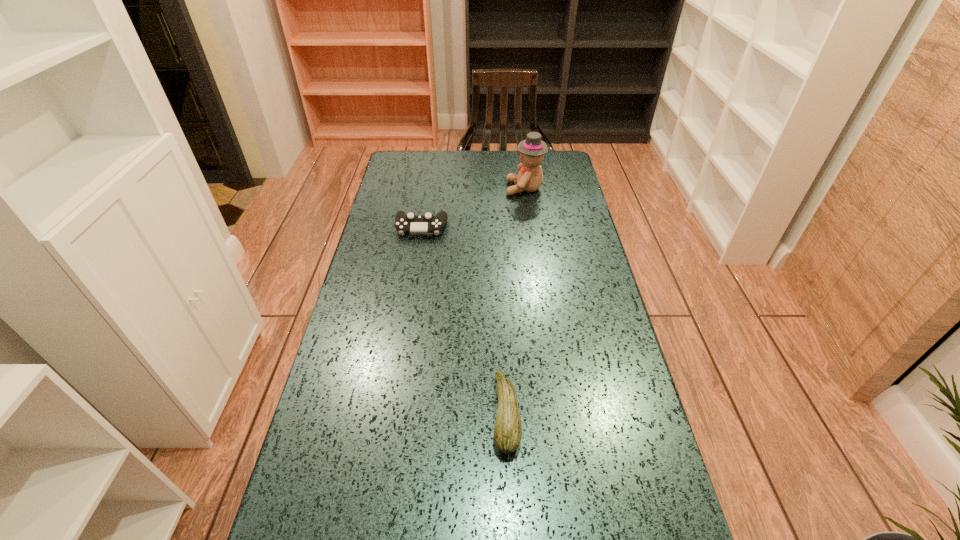
Locate an element on the screen. Image resolution: width=960 pixels, height=540 pixels. free space located at the stem end of the zucchini is located at coordinates (420, 414).

Where is `vacant area situated at the stem end of the zucchini`? This screenshot has height=540, width=960. vacant area situated at the stem end of the zucchini is located at coordinates (351, 414).

The image size is (960, 540). Find the location of `vacant space located at the stem end of the zucchini`. vacant space located at the stem end of the zucchini is located at coordinates (326, 414).

This screenshot has width=960, height=540. I want to click on object situated at the far edge, so click(531, 150).

Identify the location of object at the left edge. The image size is (960, 540). (410, 223).

Locate an element on the screen. Image resolution: width=960 pixels, height=540 pixels. object that is at the right edge is located at coordinates (531, 150).

The height and width of the screenshot is (540, 960). In order to click on object that is at the far right corner in this screenshot , I will do `click(531, 150)`.

Find the location of a particular element. This screenshot has width=960, height=540. free region at the far edge is located at coordinates (468, 160).

The image size is (960, 540). What are the coordinates of `free point at the left edge` in the screenshot? It's located at (370, 364).

The width and height of the screenshot is (960, 540). Identify the location of vacant area at the right edge of the desktop. (588, 464).